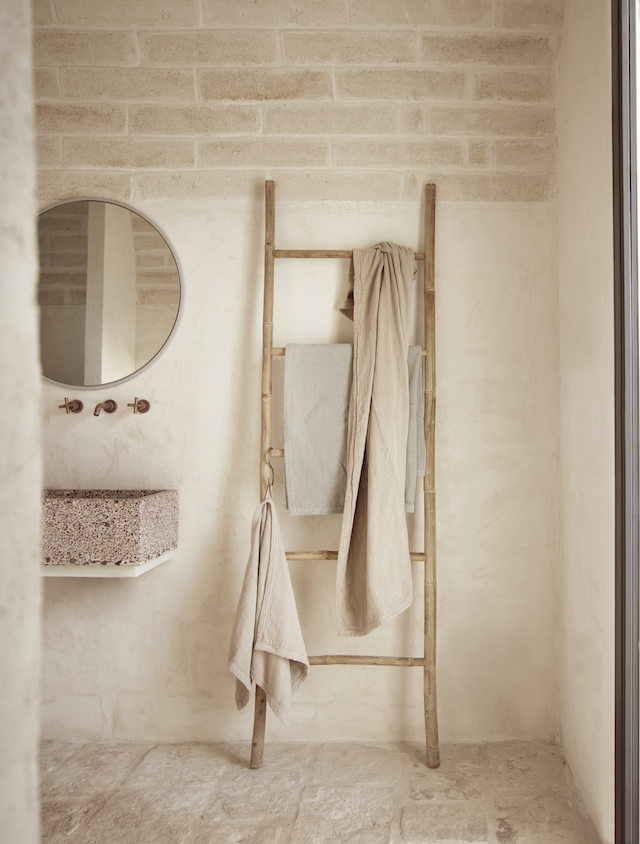
You are a GUI agent. You are given a task and a screenshot of the screen. Output one action in this format:
    pyautogui.click(x=<x>, y=<y>)
    Task: Click on the ladder step
    The height and width of the screenshot is (844, 640).
    Given the screenshot: What is the action you would take?
    pyautogui.click(x=331, y=658), pyautogui.click(x=316, y=555), pyautogui.click(x=273, y=451), pyautogui.click(x=278, y=352), pyautogui.click(x=321, y=256)